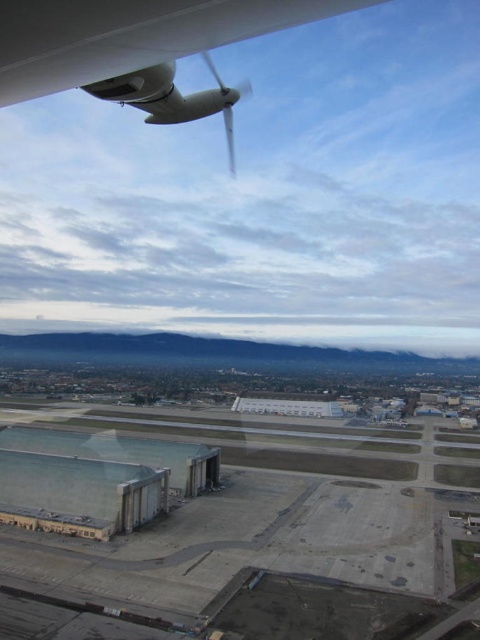
Can you confirm if white matte propeller at upper left is thinner than white plastic propeller at upper center?

Correct, white matte propeller at upper left's width is less than white plastic propeller at upper center's.

Can you confirm if white matte propeller at upper left is positioned above white plastic propeller at upper center?

Yes.

At what (x,y) coordinates should I click in order to perform the action: click on white matte propeller at upper left. Please return your answer as a coordinate pair (x, y). Looking at the image, I should click on tap(139, 49).

Does point (195, 566) come farther from viewer compared to point (36, 48)?

That is True.

In the scene shown: Can you confirm if gray concrete tarmac at lower center is bigger than white matte propeller at upper left?

Incorrect, gray concrete tarmac at lower center is not larger than white matte propeller at upper left.

Is point (90, 596) more distant than point (20, 4)?

Yes.

The width and height of the screenshot is (480, 640). I want to click on gray concrete tarmac at lower center, so click(x=230, y=541).

Does gray concrete tarmac at lower center have a larger size compared to white plastic propeller at upper center?

No.

Between gray concrete tarmac at lower center and white plastic propeller at upper center, which one appears on the right side from the viewer's perspective?

white plastic propeller at upper center is more to the right.

Who is more forward, (354, 560) or (210, 93)?

Point (210, 93) is more forward.

Identify the location of gray concrete tarmac at lower center. This screenshot has height=640, width=480. (230, 541).